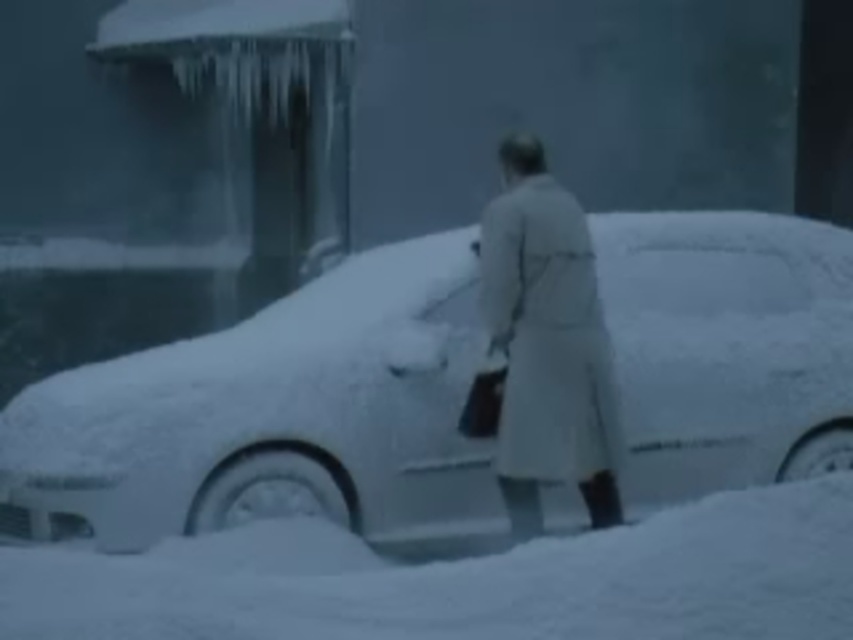
Question: Considering the real-world distances, which object is closest to the white matte car at center?

Choices:
 (A) white fluffy snow at lower center
 (B) light beige coat at center

Answer: (B)

Question: Is white matte car at center to the left of light beige coat at center from the viewer's perspective?

Choices:
 (A) no
 (B) yes

Answer: (B)

Question: Which point is closer to the camera taking this photo?

Choices:
 (A) (207, 563)
 (B) (677, 422)
 (C) (492, 259)

Answer: (A)

Question: Which point is closer to the camera?

Choices:
 (A) light beige coat at center
 (B) white fluffy snow at lower center
 (C) white matte car at center

Answer: (B)

Question: Can you confirm if white fluffy snow at lower center is positioned to the left of light beige coat at center?

Choices:
 (A) no
 (B) yes

Answer: (B)

Question: Does white matte car at center appear over light beige coat at center?

Choices:
 (A) no
 (B) yes

Answer: (A)